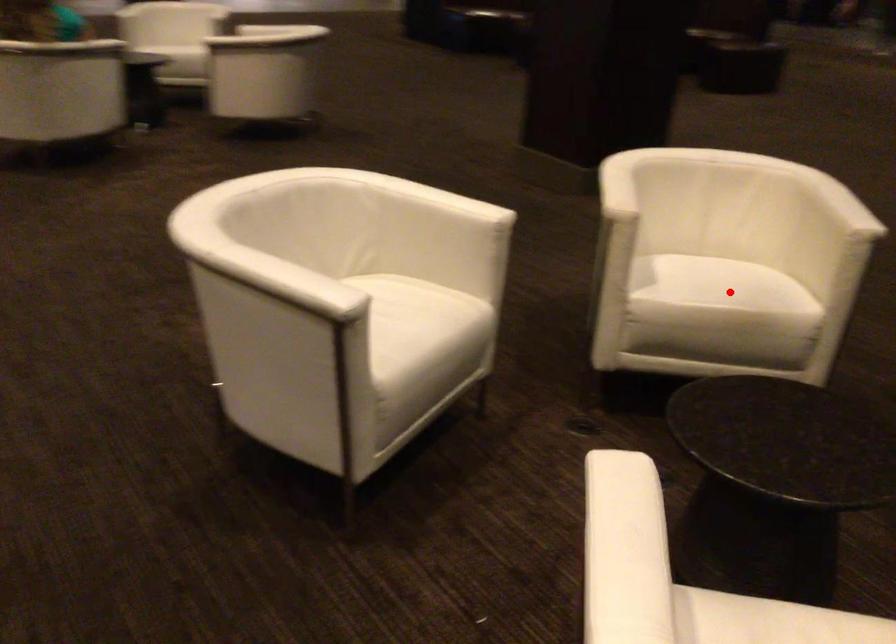
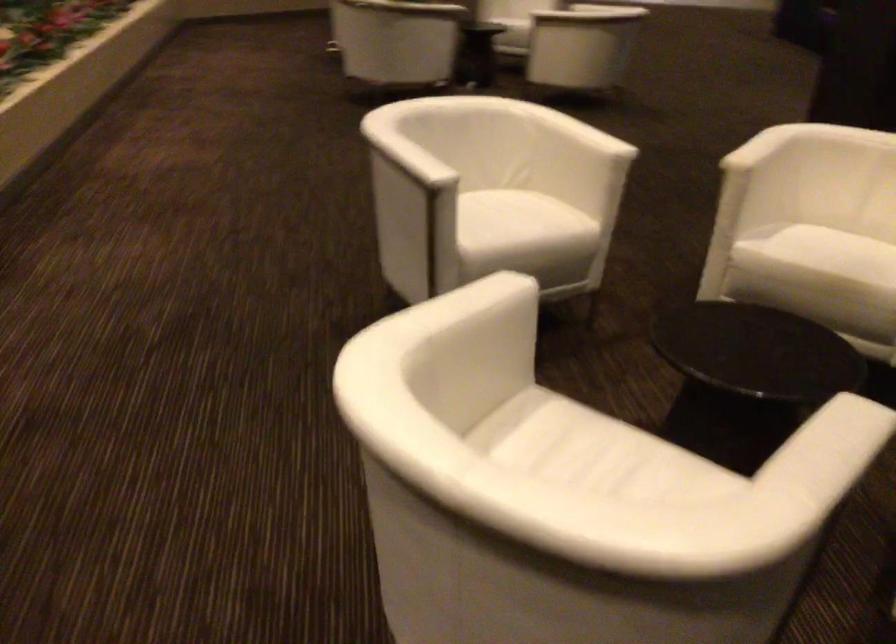
The point at the highlighted location is marked in the first image. Where is the corresponding point in the second image?

(836, 252)